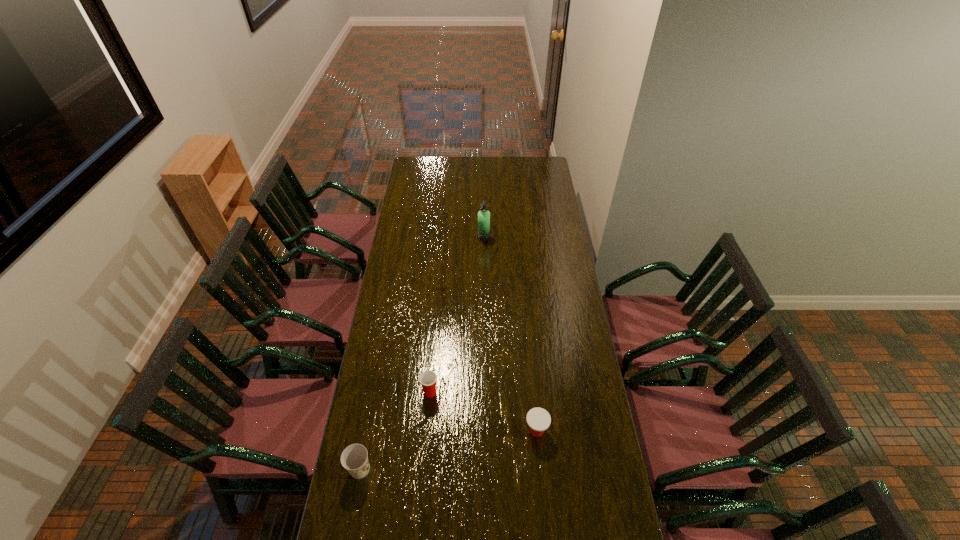
Image resolution: width=960 pixels, height=540 pixels. I want to click on vacant area that lies between the nearest object and the thermos bottle, so click(x=422, y=353).

Find the location of a particular element. This screenshot has height=540, width=960. empty location between the rightmost Dixie cup and the third object from left to right is located at coordinates 510,334.

At what (x,y) coordinates should I click in order to perform the action: click on free space between the farthest object and the farthest Dixie cup. Please return your answer as a coordinate pair (x, y). This screenshot has width=960, height=540. Looking at the image, I should click on (457, 315).

You are a GUI agent. You are given a task and a screenshot of the screen. Output one action in this format:
    pyautogui.click(x=<x>, y=<y>)
    Task: Click on the vacant area that lies between the rightmost Dixie cup and the farthest Dixie cup
    This screenshot has height=540, width=960.
    Given the screenshot: What is the action you would take?
    pyautogui.click(x=483, y=411)

You are a GUI agent. You are given a task and a screenshot of the screen. Output one action in this format:
    pyautogui.click(x=<x>, y=<y>)
    Task: Click on the empty space that is in between the nearest Dixie cup and the second farthest object
    
    Given the screenshot: What is the action you would take?
    396,430

Locate an element on the screen. Image resolution: width=960 pixels, height=540 pixels. empty space between the nearest object and the second object from left to right is located at coordinates (396, 430).

Identify the location of free space between the rightmost Dixie cup and the leftmost Dixie cup. (448, 450).

Locate an element on the screen. This screenshot has height=540, width=960. object that stands as the third closest to the shortest object is located at coordinates (483, 215).

The width and height of the screenshot is (960, 540). What are the coordinates of `object that is the nearest to the shortest Dixie cup` in the screenshot? It's located at (428, 378).

I want to click on Dixie cup that stands as the second closest to the thermos bottle, so click(538, 419).